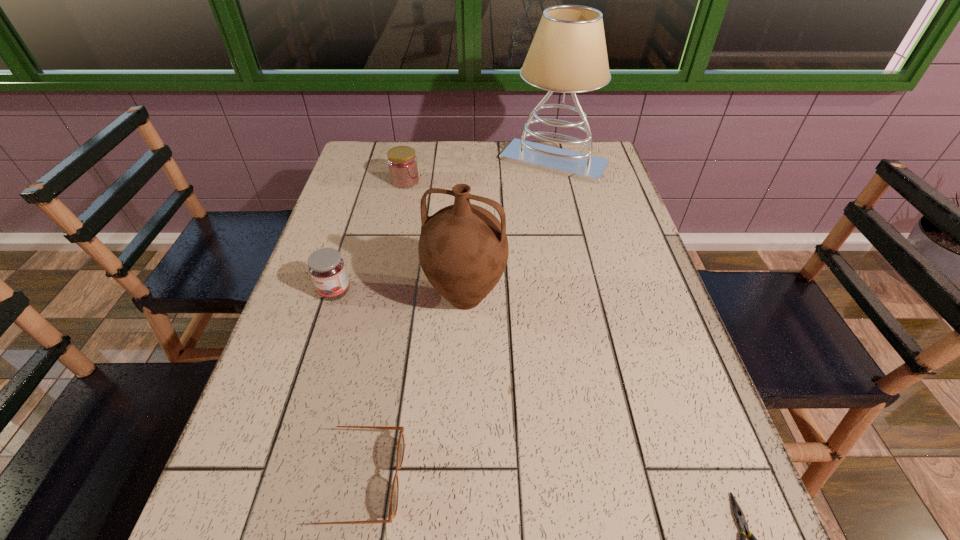
Identify the location of free spot at the far edge of the desktop. click(x=460, y=157).

Where is `free space at the left edge of the desktop`? This screenshot has height=540, width=960. free space at the left edge of the desktop is located at coordinates (288, 323).

The width and height of the screenshot is (960, 540). What are the coordinates of `vacant space at the right edge` in the screenshot? It's located at (619, 224).

The width and height of the screenshot is (960, 540). Identify the location of empty location between the farther jam and the sunglasses. (380, 330).

This screenshot has height=540, width=960. I want to click on free space between the tallest object and the right jam, so [x=479, y=171].

Identify the location of empty space that is in between the farther jam and the left jam. The height and width of the screenshot is (540, 960). (370, 237).

This screenshot has height=540, width=960. In order to click on unoccupied position between the second shortest object and the nearer jam in this screenshot , I will do `click(345, 386)`.

Identify the location of vacant region between the fourth object from left to right and the fifth tallest object. (410, 389).

At what (x,y) coordinates should I click in order to perform the action: click on object that ranks as the fifth closest to the tallest object. Please return your answer as a coordinate pair (x, y). Image resolution: width=960 pixels, height=540 pixels. Looking at the image, I should click on (738, 513).

Select which object appears as the third closest to the sunglasses. Please provide its 2D coordinates. Your answer should be formatted as a tuple, i.e. [(x, y)], where the tuple contains the x and y coordinates of a point satisfying the conditions above.

[(738, 513)]